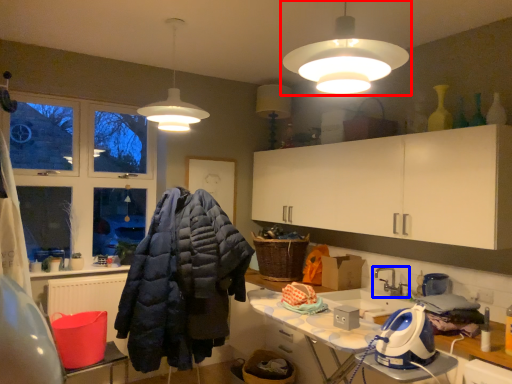
Question: Which object appears farthest to the camera in this image, lamp (highlighted by a red box) or tap (highlighted by a blue box)?

Choices:
 (A) lamp
 (B) tap

Answer: (B)